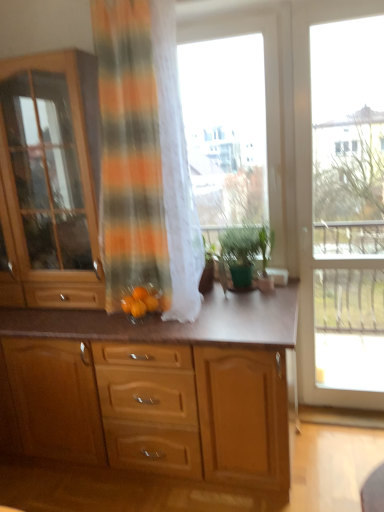
Question: Is transparent glass door at right, which ranks as the first window in right-to-left order, turned away from green matte plant at center?

Choices:
 (A) yes
 (B) no

Answer: (B)

Question: Is transparent glass door at right, which appears as the second window when viewed from the left, to the right of green matte plant at center from the viewer's perspective?

Choices:
 (A) yes
 (B) no

Answer: (A)

Question: From a real-world perspective, does transparent glass door at right, which appears as the second window when viewed from the left, stand above green matte plant at center?

Choices:
 (A) no
 (B) yes

Answer: (B)

Question: Is transparent glass door at right, which appears as the second window when viewed from the left, closer to the viewer compared to green matte plant at center?

Choices:
 (A) yes
 (B) no

Answer: (A)

Question: Is transparent glass door at right, which ranks as the first window in right-to-left order, taller than green matte plant at center?

Choices:
 (A) yes
 (B) no

Answer: (A)

Question: Looking at their shapes, would you say transparent glass window at center, which ranks as the first window in left-to-right order, is wider or thinner than orange matte tangerine at center, arranged as the first tangerine when viewed from the right?

Choices:
 (A) thin
 (B) wide

Answer: (B)

Question: In the image, is transparent glass window at center, which ranks as the first window in left-to-right order, positioned in front of or behind orange matte tangerine at center, the second tangerine positioned from the left?

Choices:
 (A) behind
 (B) front

Answer: (A)

Question: Is transparent glass window at center, which ranks as the first window in left-to-right order, to the left or to the right of orange matte tangerine at center, arranged as the first tangerine when viewed from the right, in the image?

Choices:
 (A) right
 (B) left

Answer: (A)

Question: Considering the positions of transparent glass window at center, which ranks as the first window in left-to-right order, and orange matte tangerine at center, the second tangerine positioned from the left, in the image, is transparent glass window at center, which ranks as the first window in left-to-right order, taller or shorter than orange matte tangerine at center, the second tangerine positioned from the left,?

Choices:
 (A) tall
 (B) short

Answer: (A)

Question: From a real-world perspective, is wooden cabinet at left, marked as the first cabinetry in a top-to-bottom arrangement, above or below wooden cabinet at center, which is the 2th cabinetry from top to bottom?

Choices:
 (A) below
 (B) above

Answer: (B)

Question: From the image's perspective, is wooden cabinet at left, which is the 2th cabinetry in bottom-to-top order, positioned above or below wooden cabinet at center, which is the 2th cabinetry from top to bottom?

Choices:
 (A) above
 (B) below

Answer: (A)

Question: Considering the positions of wooden cabinet at left, which is the 2th cabinetry in bottom-to-top order, and wooden cabinet at center, marked as the first cabinetry in a bottom-to-top arrangement, in the image, is wooden cabinet at left, which is the 2th cabinetry in bottom-to-top order, taller or shorter than wooden cabinet at center, marked as the first cabinetry in a bottom-to-top arrangement,?

Choices:
 (A) short
 (B) tall

Answer: (B)

Question: Is wooden cabinet at left, which is the 2th cabinetry in bottom-to-top order, inside the boundaries of wooden cabinet at center, which is the 2th cabinetry from top to bottom, or outside?

Choices:
 (A) outside
 (B) inside

Answer: (A)

Question: From a real-world perspective, is orange striped fabric at center positioned above or below wooden cabinet at center, marked as the first cabinetry in a bottom-to-top arrangement?

Choices:
 (A) below
 (B) above

Answer: (B)

Question: Is orange striped fabric at center spatially inside wooden cabinet at center, marked as the first cabinetry in a bottom-to-top arrangement, or outside of it?

Choices:
 (A) inside
 (B) outside

Answer: (B)